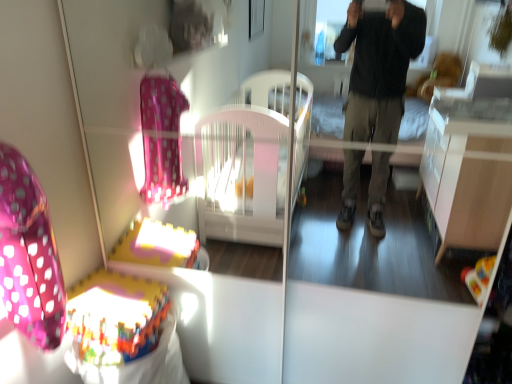
Question: Considering the relative positions of multicolored plastic baby carriage at lower left and pink polka dot fabric swivel chair at left in the image provided, is multicolored plastic baby carriage at lower left to the left of pink polka dot fabric swivel chair at left from the viewer's perspective?

Choices:
 (A) yes
 (B) no

Answer: (B)

Question: Is multicolored plastic baby carriage at lower left closer to the viewer compared to pink polka dot fabric swivel chair at left?

Choices:
 (A) no
 (B) yes

Answer: (A)

Question: Is multicolored plastic baby carriage at lower left outside of pink polka dot fabric swivel chair at left?

Choices:
 (A) no
 (B) yes

Answer: (B)

Question: From the image's perspective, is multicolored plastic baby carriage at lower left beneath pink polka dot fabric swivel chair at left?

Choices:
 (A) no
 (B) yes

Answer: (B)

Question: Is multicolored plastic baby carriage at lower left facing away from pink polka dot fabric swivel chair at left?

Choices:
 (A) yes
 (B) no

Answer: (B)

Question: Is multicolored plastic baby carriage at lower left thinner than pink polka dot fabric swivel chair at left?

Choices:
 (A) yes
 (B) no

Answer: (B)

Question: Considering the relative sizes of pink polka dot fabric swivel chair at left and multicolored plastic baby carriage at lower left in the image provided, is pink polka dot fabric swivel chair at left shorter than multicolored plastic baby carriage at lower left?

Choices:
 (A) no
 (B) yes

Answer: (A)

Question: Is pink polka dot fabric swivel chair at left placed right next to multicolored plastic baby carriage at lower left?

Choices:
 (A) no
 (B) yes

Answer: (A)

Question: Is pink polka dot fabric swivel chair at left taller than multicolored plastic baby carriage at lower left?

Choices:
 (A) yes
 (B) no

Answer: (A)

Question: From a real-world perspective, is pink polka dot fabric swivel chair at left located higher than multicolored plastic baby carriage at lower left?

Choices:
 (A) yes
 (B) no

Answer: (A)

Question: From the image's perspective, would you say pink polka dot fabric swivel chair at left is shown under multicolored plastic baby carriage at lower left?

Choices:
 (A) no
 (B) yes

Answer: (A)

Question: Does pink polka dot fabric swivel chair at left come behind multicolored plastic baby carriage at lower left?

Choices:
 (A) yes
 (B) no

Answer: (B)

Question: From a real-world perspective, is multicolored plastic baby carriage at lower left positioned above or below pink polka dot fabric swivel chair at left?

Choices:
 (A) below
 (B) above

Answer: (A)